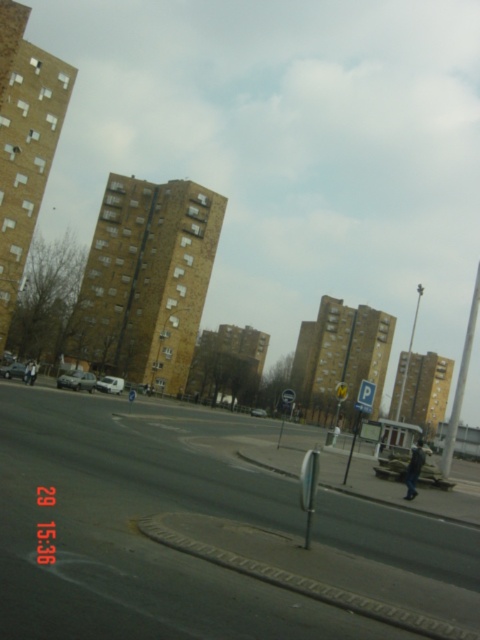
You are a delivery driver who needs to park your vehicle in the parking area near the road. Your vehicle is the same size as the silver metallic car at center. Can you safely park in a spot that is currently occupied by the matte silver van at lower left?

The silver metallic car at center might be wider than matte silver van at lower left, so there is a possibility that the parking spot occupied by the matte silver van at lower left may not be wide enough for your vehicle. It is recommended to look for another parking spot.

You are driving a car and want to park in the parking area indicated by the sign. You see the smooth asphalt road at center and the metallic silver car at center. Which object is positioned to the left of the other?

The smooth asphalt road at center is to the left of the metallic silver car at center.